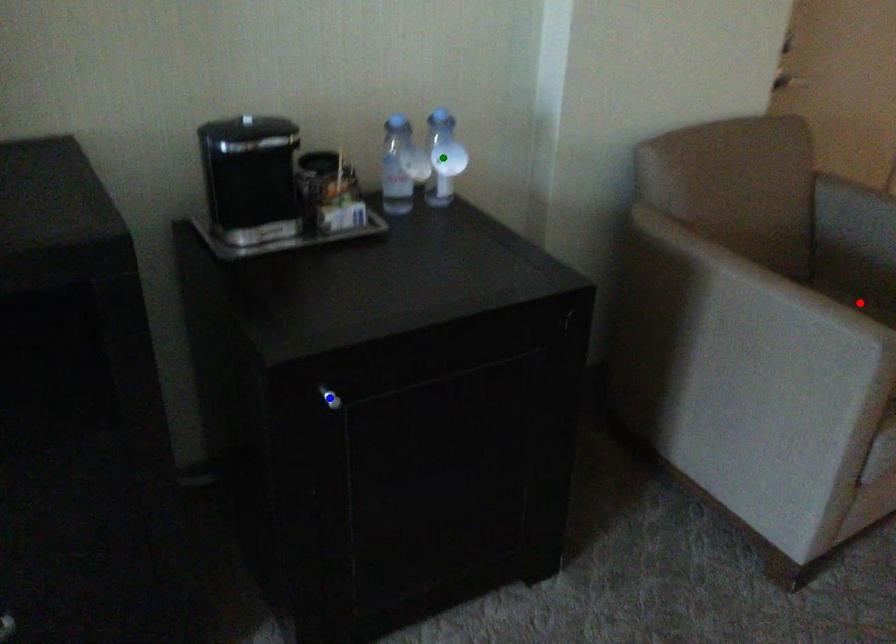
Order these from farthest to nearest:
green point
red point
blue point

red point < green point < blue point